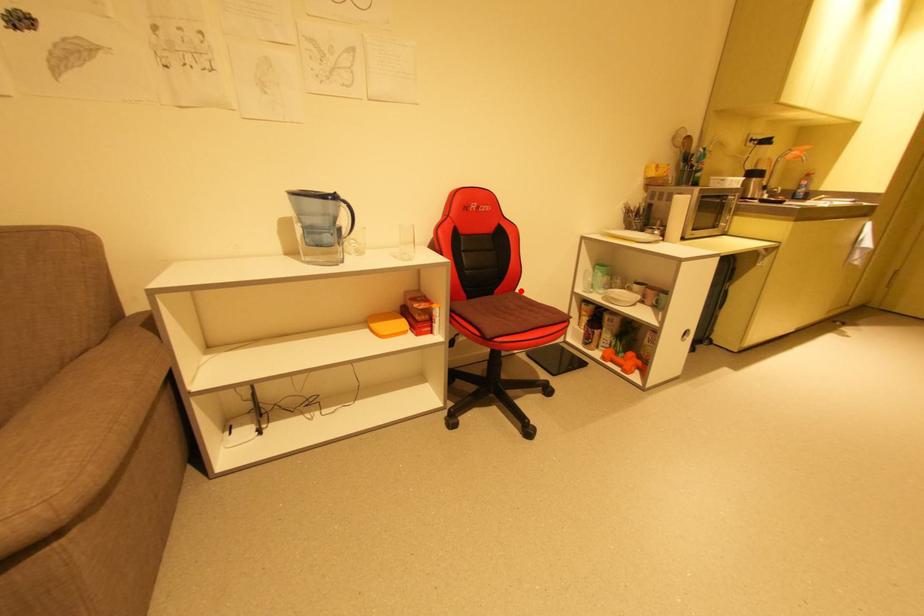
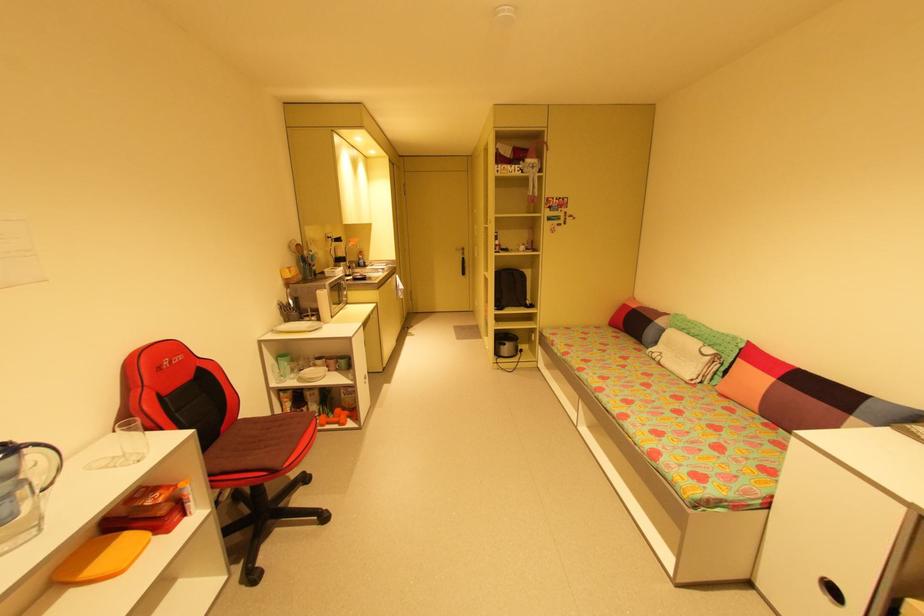
Where in the second image is the point corresponding to the highlighted location from the first image?

(244, 418)